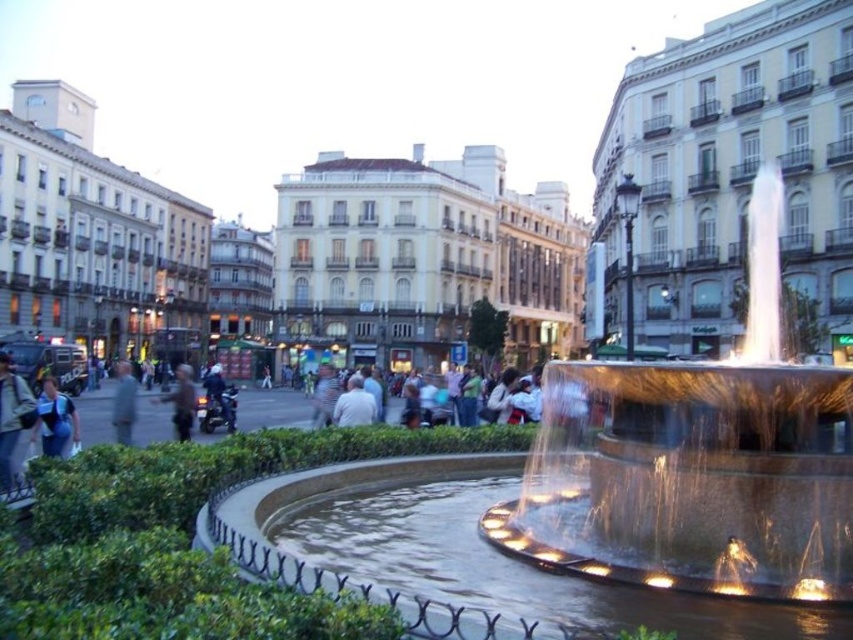
Consider the image. You are standing in the public square and want to walk from the point at coordinates point (358,412) to the point at coordinates point (192,390). Given that the fountain is between these two points, will you have to go around it or can you walk straight through?

Since point (358,412) is in front of point (192,390), you will have to go around the fountain because the fountain is between these two points and you cannot walk straight through it.

You are standing in the public square and want to take a photo of the fountain. You notice two people wearing a light gray shirt at center and a dark brown leather jacket at center. Which person is positioned closer to the fountain to get a better shot?

The light gray shirt at center is closer to the viewer than the dark brown leather jacket at center, so the person in the light gray shirt at center is positioned closer to the fountain and would get a better shot.

You are standing in the public square and see two jackets at the center. Which jacket is nearer to you, the light blue denim jacket at center or the dark brown leather jacket at center?

The light blue denim jacket at center is closer to the viewer than the dark brown leather jacket at center.